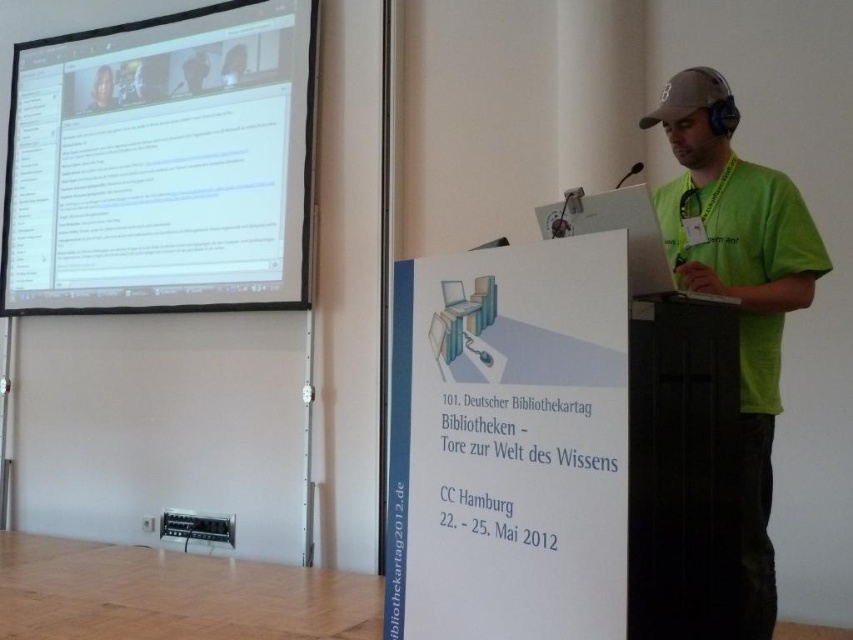
Which is in front, point (773, 172) or point (96, 72)?

Point (773, 172)

Where is `green t-shirt at center`? The height and width of the screenshot is (640, 853). green t-shirt at center is located at coordinates (738, 284).

Measure the distance between point (285, 205) and camera.

Point (285, 205) is 3.56 meters from camera.

How distant is white glossy projector screen at upper left from green t-shirt at center?

white glossy projector screen at upper left is 8.20 feet away from green t-shirt at center.

This screenshot has height=640, width=853. Identify the location of white glossy projector screen at upper left. (163, 164).

Is point (299, 195) farther from camera compared to point (107, 72)?

No, (299, 195) is closer to viewer.

Who is taller, white glossy projector screen at upper left or smooth skin face at upper left?

white glossy projector screen at upper left

Image resolution: width=853 pixels, height=640 pixels. I want to click on white glossy projector screen at upper left, so click(163, 164).